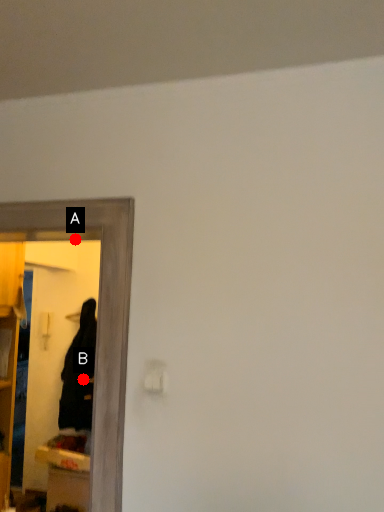
Question: Two points are circled on the image, labeled by A and B beside each circle. Which point is closer to the camera?

Choices:
 (A) A is closer
 (B) B is closer

Answer: (A)